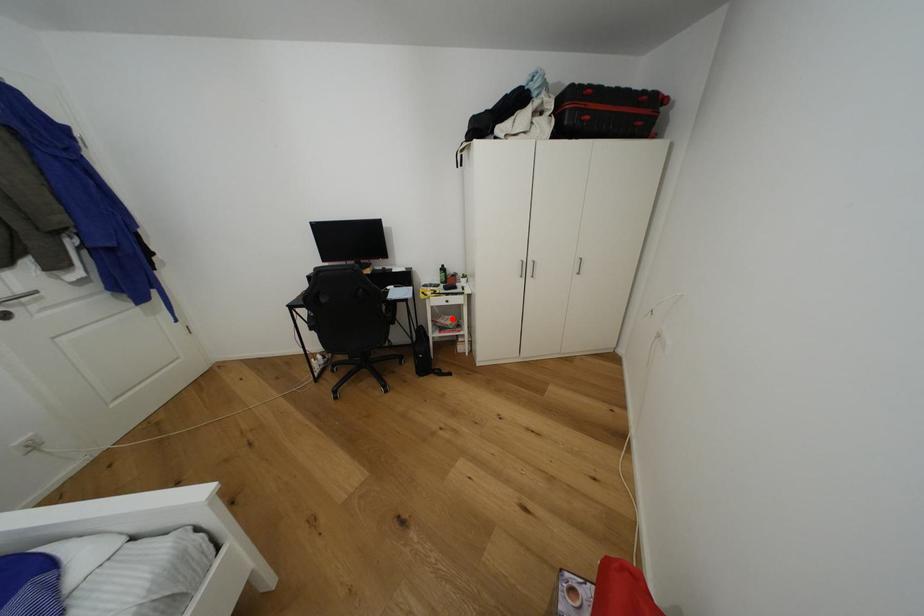
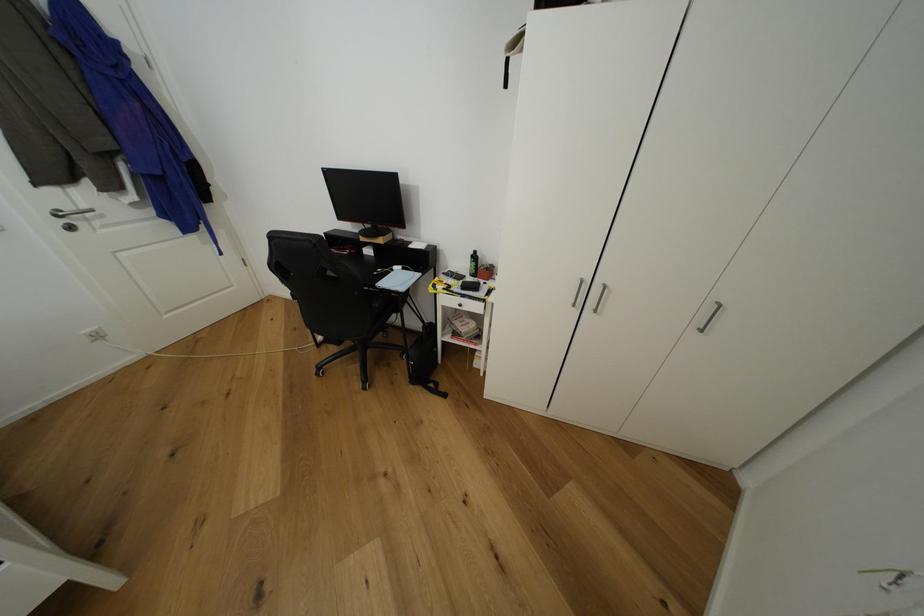
The point at the highlighted location is marked in the first image. Where is the corresponding point in the second image?

(472, 322)